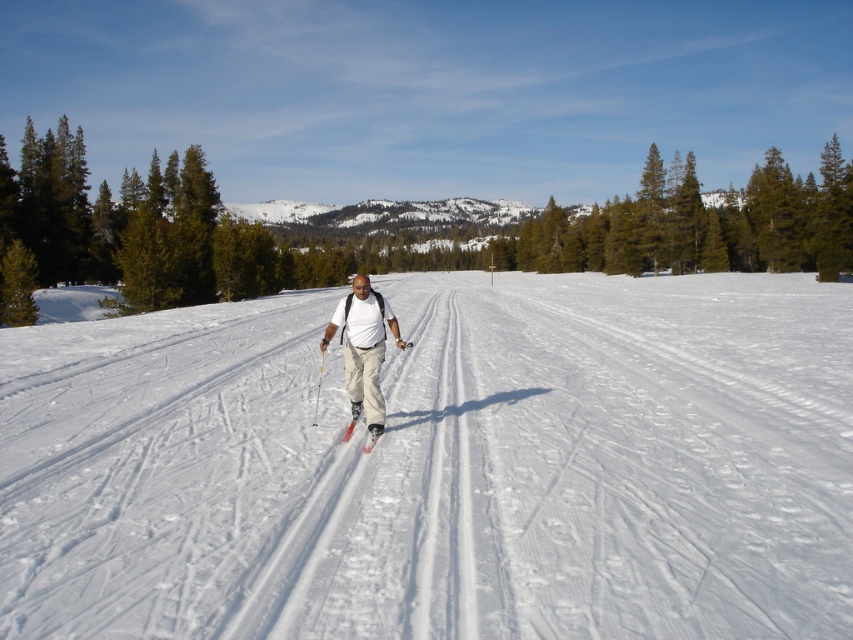
Which of these two, white snow at center or matte white shirt at center, stands shorter?

matte white shirt at center

Which is in front, point (241, 474) or point (350, 378)?

Point (241, 474)

Find the location of `white snow at center`. white snow at center is located at coordinates (439, 467).

Does matte white shirt at center appear on the right side of white matte ski at center?

In fact, matte white shirt at center is to the left of white matte ski at center.

Is point (357, 273) more distant than point (347, 428)?

Yes, it is.

Where is `matte white shirt at center`? matte white shirt at center is located at coordinates (363, 349).

Who is positioned more to the left, white snow at center or white matte ski at center?

Positioned to the left is white matte ski at center.

Consider the image. Who is more distant from viewer, (474, 544) or (370, 435)?

Positioned behind is point (370, 435).

In order to click on white snow at center in this screenshot , I will do `click(439, 467)`.